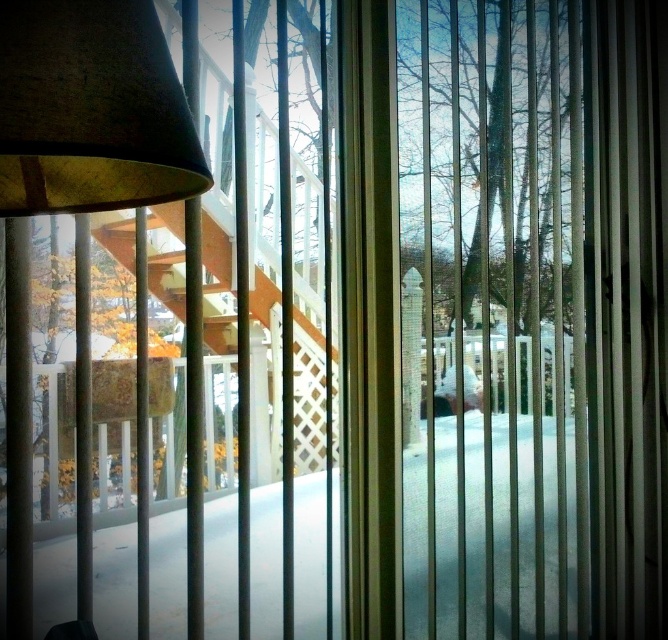
Which is more to the right, translucent plastic curtain at center or matte brown lampshade at left?

translucent plastic curtain at center

Is translucent plastic curtain at center taller than matte brown lampshade at left?

Correct, translucent plastic curtain at center is much taller as matte brown lampshade at left.

Is point (667, 29) less distant than point (84, 22)?

No.

The width and height of the screenshot is (668, 640). Find the location of `translucent plastic curtain at center`. translucent plastic curtain at center is located at coordinates (629, 310).